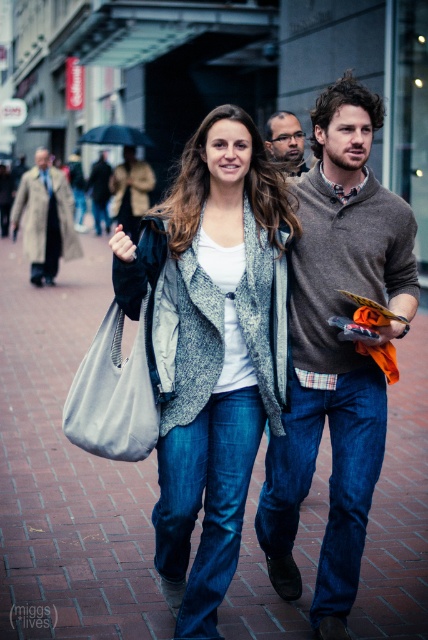
Question: Which point is farther from the camera taking this photo?

Choices:
 (A) (315, 614)
 (B) (360, 99)

Answer: (B)

Question: Which object appears farthest from the camera in this image?

Choices:
 (A) brick pavement at center
 (B) matte brown sweater at center
 (C) smooth brown hair at center
 (D) knit sweater at center

Answer: (B)

Question: Is canvas tote bag at center to the left of matte gray coat at center from the viewer's perspective?

Choices:
 (A) yes
 (B) no

Answer: (B)

Question: Can you confirm if brick pavement at center is positioned below knitted gray cardigan at center?

Choices:
 (A) no
 (B) yes

Answer: (A)

Question: Is knit sweater at center thinner than matte gray coat at center?

Choices:
 (A) no
 (B) yes

Answer: (B)

Question: Which object is the farthest from the knit sweater at center?

Choices:
 (A) brick pavement at center
 (B) light beige coat at left

Answer: (B)